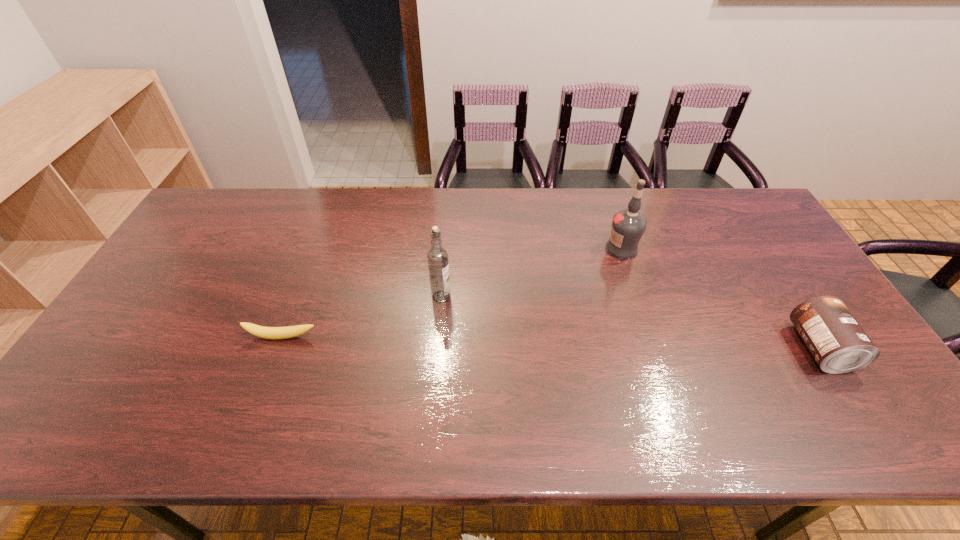
The height and width of the screenshot is (540, 960). In order to click on free spot on the desktop that is between the banana and the rightmost object and is positioned on the front label of the third object from left to right in this screenshot , I will do `click(486, 341)`.

At what (x,y) coordinates should I click in order to perform the action: click on free spot on the desktop that is between the leftmost object and the rightmost object and is positioned on the label of the third object from right to left. Please return your answer as a coordinate pair (x, y). The width and height of the screenshot is (960, 540). Looking at the image, I should click on (491, 341).